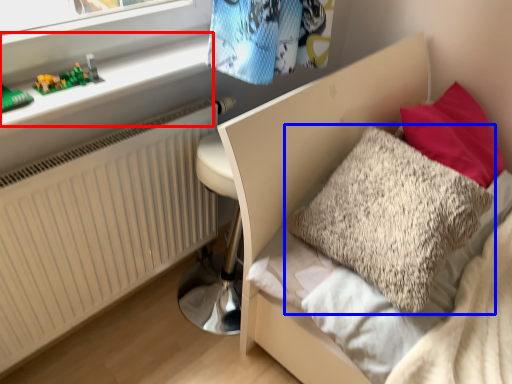
Question: Among these objects, which one is farthest to the camera, window sill (highlighted by a red box) or pillow (highlighted by a blue box)?

Choices:
 (A) window sill
 (B) pillow

Answer: (A)